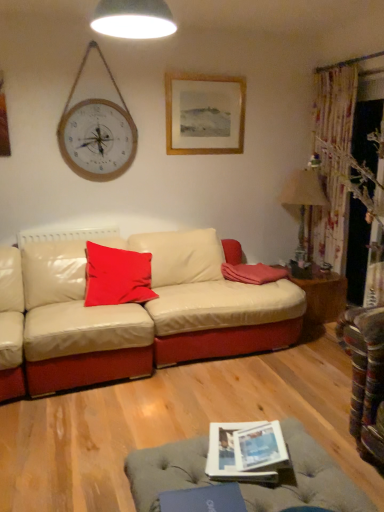
The height and width of the screenshot is (512, 384). Identify the location of free spot above matte paper magazine at lower center (from a real-world perspective). (238, 443).